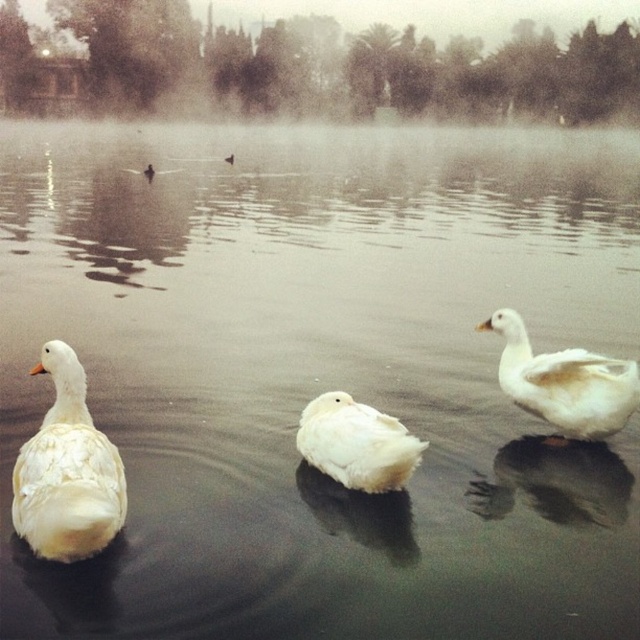
Question: Where is foggy mist at upper center located in relation to white fluffy goose at left in the image?

Choices:
 (A) below
 (B) above

Answer: (B)

Question: Among these objects, which one is nearest to the camera?

Choices:
 (A) white fluffy goose at left
 (B) foggy mist at upper center
 (C) white fluffy goose at center

Answer: (A)

Question: Does foggy mist at upper center appear on the right side of white fluffy goose at right?

Choices:
 (A) yes
 (B) no

Answer: (B)

Question: Does foggy mist at upper center have a greater width compared to white fluffy goose at right?

Choices:
 (A) yes
 (B) no

Answer: (A)

Question: Which point is closer to the camera?

Choices:
 (A) white fluffy goose at left
 (B) white fluffy goose at center
 (C) white fluffy goose at right

Answer: (A)

Question: Among these points, which one is nearest to the camera?

Choices:
 (A) (337, 390)
 (B) (77, 436)
 (C) (580, 358)

Answer: (B)